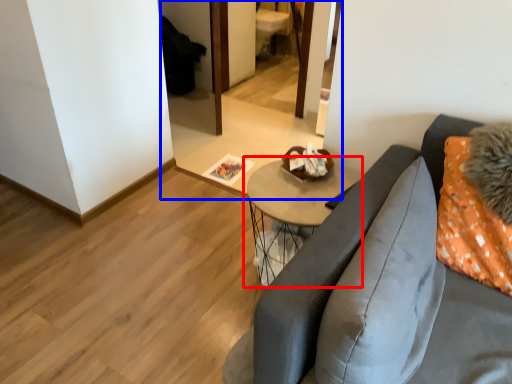
Question: Which of the following is the closest to the observer, table (highlighted by a red box) or mirror (highlighted by a blue box)?

Choices:
 (A) table
 (B) mirror

Answer: (A)